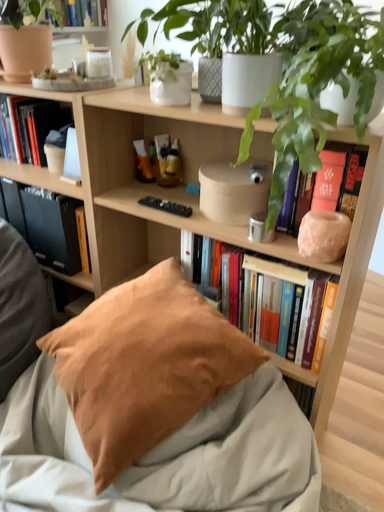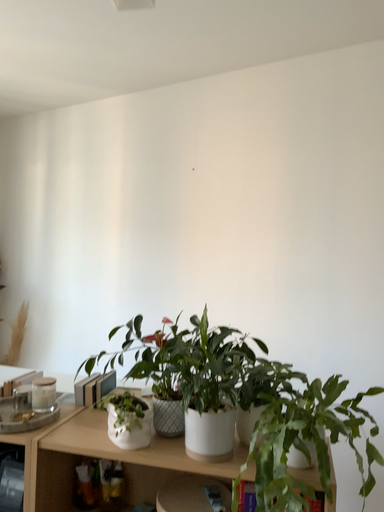
Question: Which way did the camera rotate in the video?

Choices:
 (A) rotated upward
 (B) rotated downward

Answer: (A)